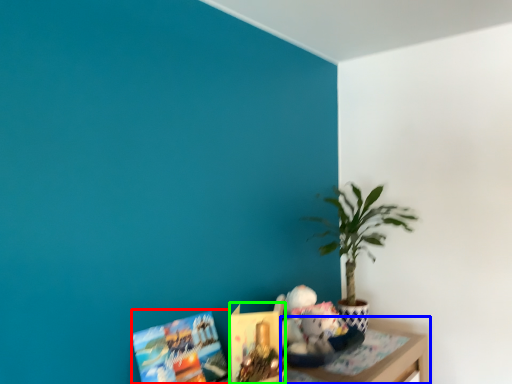
Question: Considering the real-world distances, which object is farthest from book (highlighted by a red box)? table (highlighted by a blue box) or book (highlighted by a green box)?

Choices:
 (A) table
 (B) book

Answer: (A)